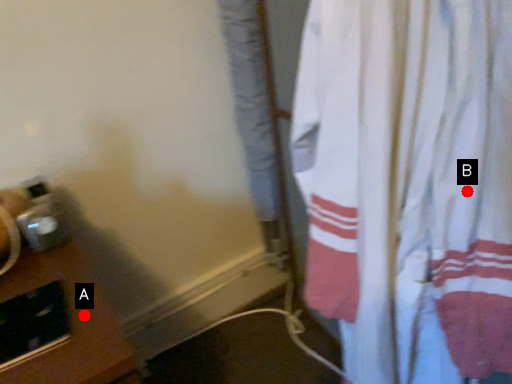
Question: Two points are circled on the image, labeled by A and B beside each circle. Among these points, which one is farthest from the camera?

Choices:
 (A) A is further
 (B) B is further

Answer: (A)